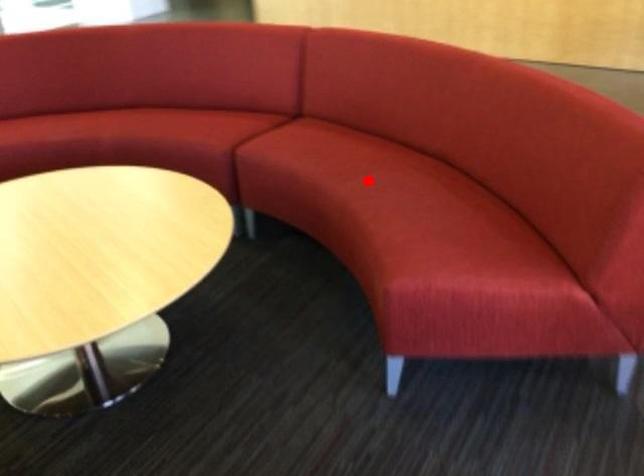
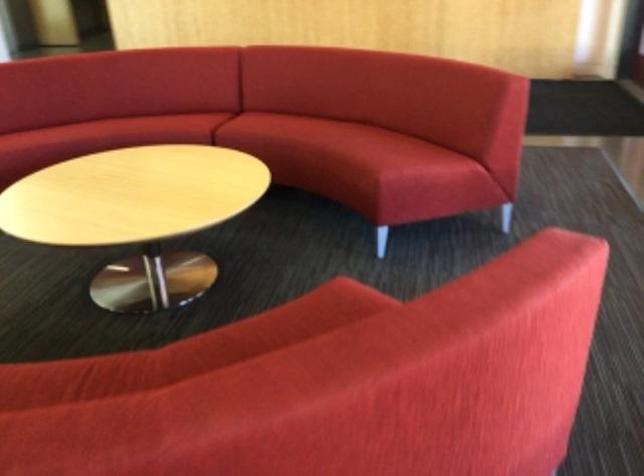
In the second image, find the point that corresponds to the highlighted location in the first image.

(326, 134)